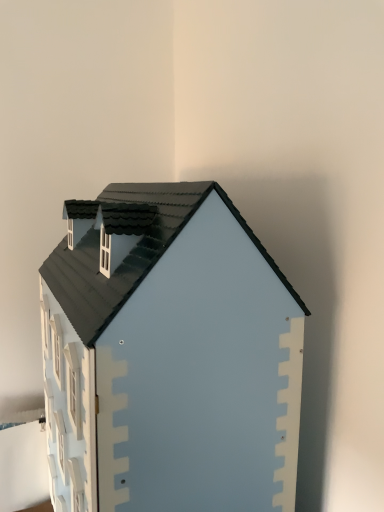
Measure the distance between matte blue wooden house at center and camera.

The depth of matte blue wooden house at center is 22.02 inches.

At what (x,y) coordinates should I click in order to perform the action: click on matte blue wooden house at center. Please return your answer as a coordinate pair (x, y). Looking at the image, I should click on (169, 356).

This screenshot has height=512, width=384. What do you see at coordinates (169, 356) in the screenshot? I see `matte blue wooden house at center` at bounding box center [169, 356].

Measure the distance between point (x=220, y=384) and camera.

A distance of 25.75 inches exists between point (x=220, y=384) and camera.

You are a GUI agent. You are given a task and a screenshot of the screen. Output one action in this format:
    pyautogui.click(x=<x>, y=<y>)
    Task: Click on the matte blue wooden house at center
    
    Given the screenshot: What is the action you would take?
    pyautogui.click(x=169, y=356)